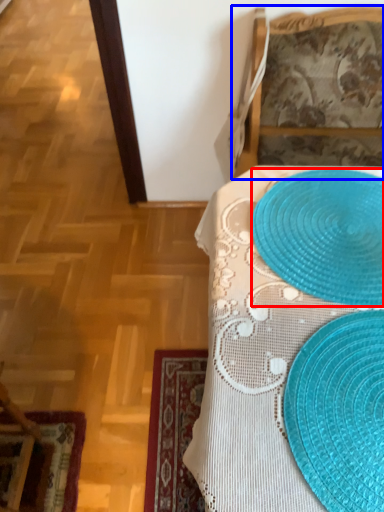
Question: Which point is further to the camera, platter (highlighted by a red box) or furniture (highlighted by a blue box)?

Choices:
 (A) platter
 (B) furniture

Answer: (B)